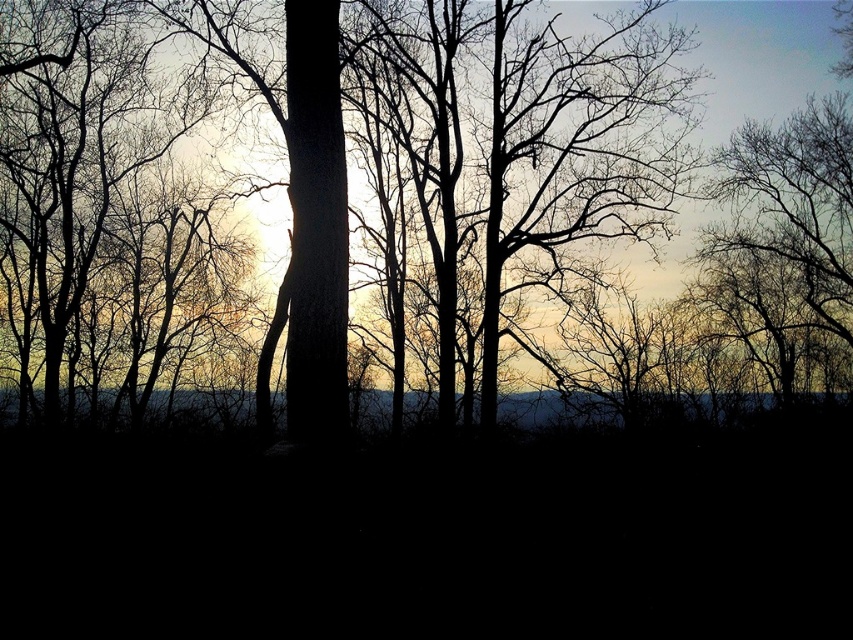
Does smooth bark tree at center have a greater width compared to silhouette bark tree at center?

Correct, the width of smooth bark tree at center exceeds that of silhouette bark tree at center.

Between smooth bark tree at center and silhouette bark tree at center, which one is positioned higher?

silhouette bark tree at center is above.

What do you see at coordinates (398, 179) in the screenshot?
I see `smooth bark tree at center` at bounding box center [398, 179].

This screenshot has width=853, height=640. In order to click on smooth bark tree at center in this screenshot , I will do `click(398, 179)`.